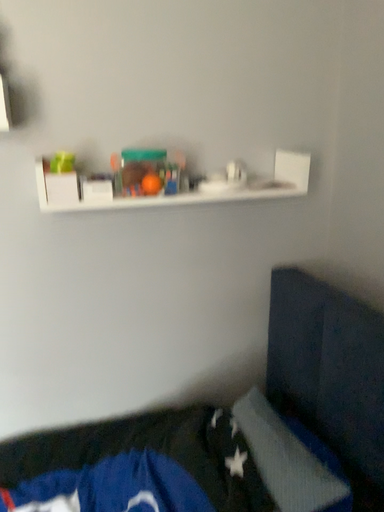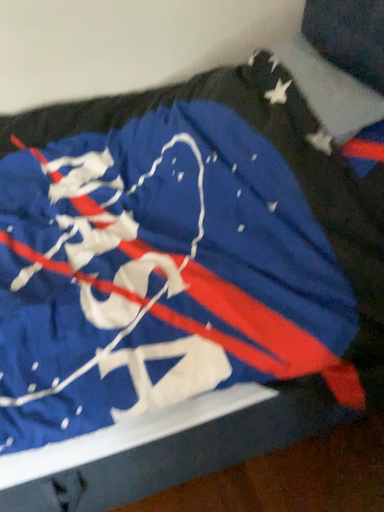
Question: Which way did the camera rotate in the video?

Choices:
 (A) rotated downward
 (B) rotated upward

Answer: (A)